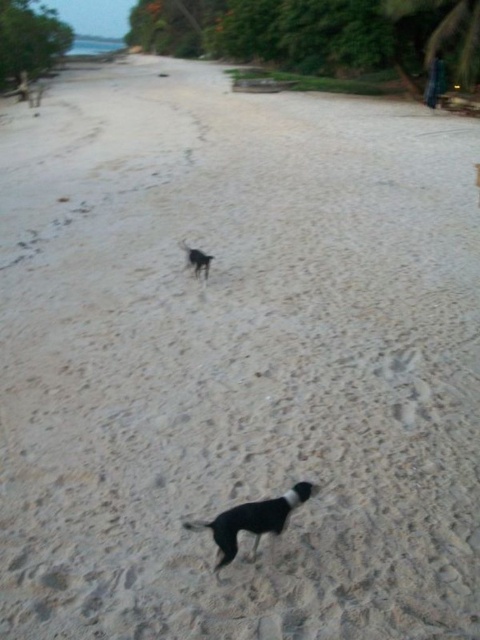
Question: Can you confirm if black fur dog at center is thinner than black matte dog at center?

Choices:
 (A) yes
 (B) no

Answer: (B)

Question: Does black fur dog at center appear on the right side of black matte dog at center?

Choices:
 (A) yes
 (B) no

Answer: (A)

Question: Which point is farther from the camera taking this photo?

Choices:
 (A) (x=235, y=506)
 (B) (x=193, y=264)

Answer: (B)

Question: Is black fur dog at center below black matte dog at center?

Choices:
 (A) no
 (B) yes

Answer: (B)